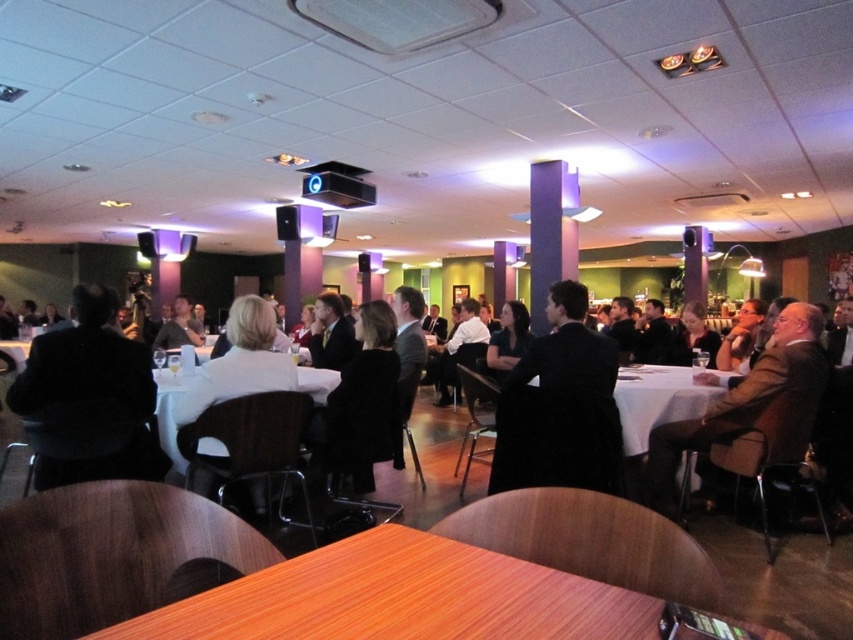
You are standing at the entrance of the conference hall and see the point marked at coordinates (402, 596). What object is located at that point?

The wooden table at center is located at point (402, 596).

You are standing at the entrance of the conference hall and want to find the wooden table at center. According to the coordinates provided, where should you look to locate it?

The wooden table at center is located at the coordinates point (402,596), so you should look towards the right side of the conference hall since the x coordinate is close to 1.0, which typically represents the rightmost edge in such coordinate systems.

You are an event planner standing at the entrance of the conference hall. You need to place a large centerpiece on the wooden table at center. Considering the position of the white matte jacket at center, will the centerpiece block the view of the presenter from the front row seats?

The wooden table at center is in front of the white matte jacket at center, so placing the large centerpiece on the wooden table at center might block the view of the presenter from the front row seats if the jacket wearer is sitting behind the table.